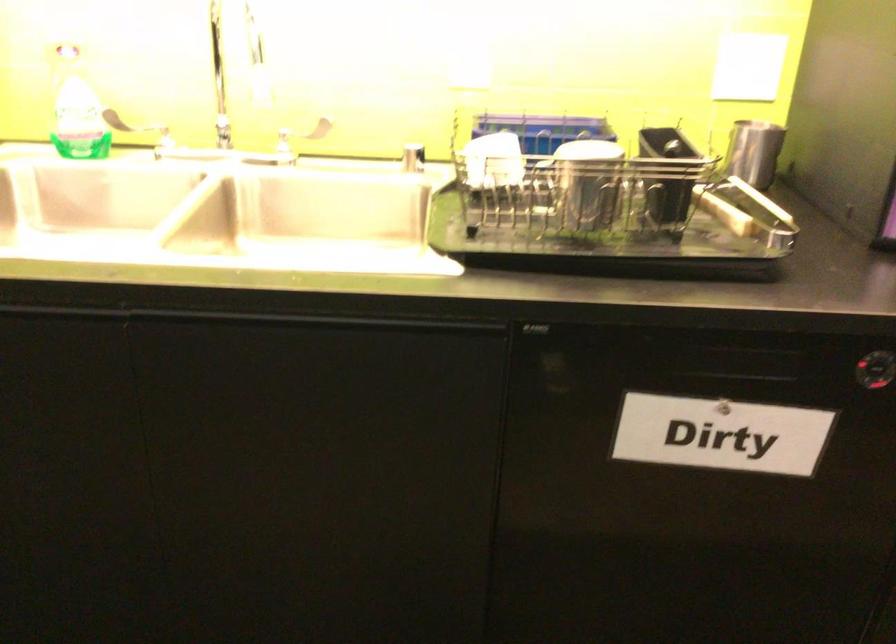
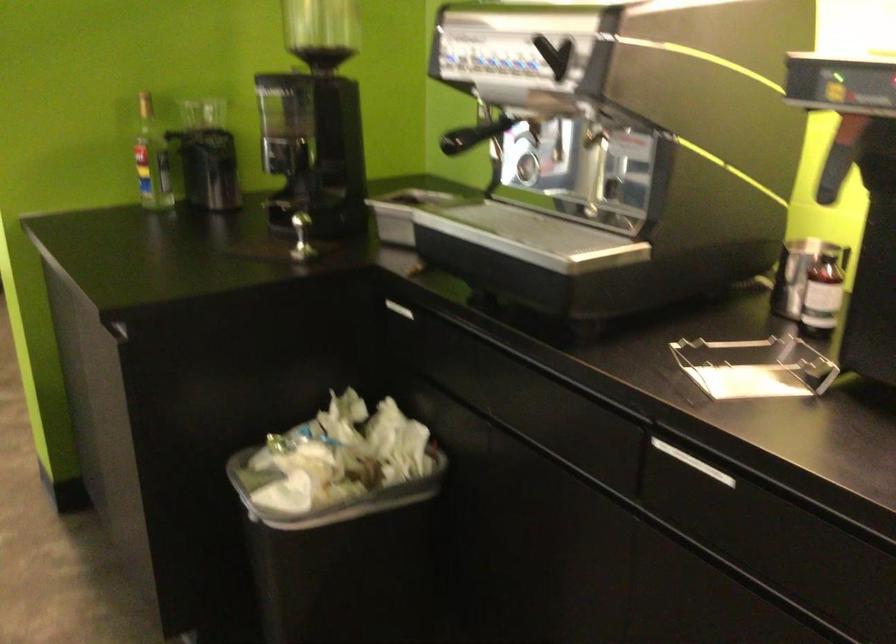
Question: Based on the continuous images, in which direction is the camera rotating? Reply with the corresponding letter.

Choices:
 (A) Left
 (B) Right
 (C) Up
 (D) Down

Answer: (A)